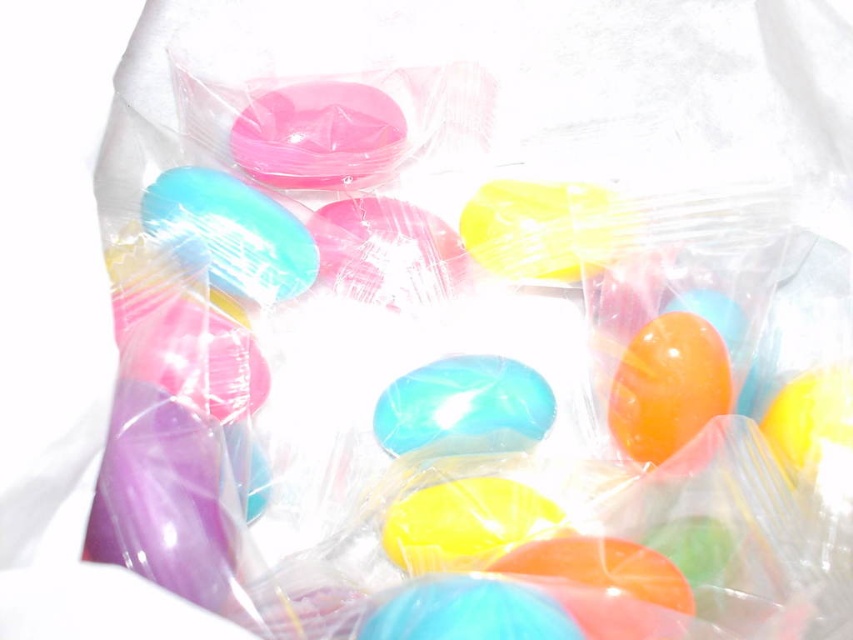
Who is more distant from viewer, (334, 100) or (439, 396)?

Point (334, 100)

Who is positioned more to the left, matte pink candy at upper center or translucent glossy jelly bean at center?

From the viewer's perspective, matte pink candy at upper center appears more on the left side.

Locate an element on the screen. matte pink candy at upper center is located at coordinates (317, 134).